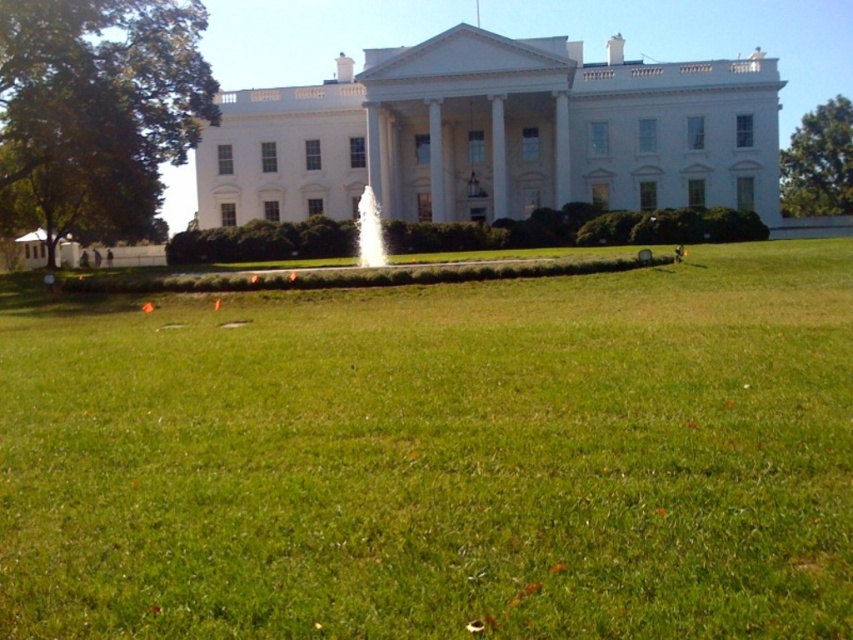
Based on the photo, you are standing at the entrance of the White House and want to walk towards the fountain located at the center of the lawn. The fountain is marked at coordinate point 0.716 on the x axis and 0.513 on the y axis. If you start walking straight ahead from the entrance, will you reach the fountain before reaching the green grass at center?

The green grass at center is located at the same coordinates as the fountain, so walking straight ahead from the entrance will lead you to both the fountain and the green grass at center simultaneously.

You are planning a small outdoor event on the lawn of the White House. You need to place a 3m wide tent. Considering the green grass at center and the white stone fountain at center, which area can accommodate the tent without overlapping the fountain?

The green grass at center has a greater width than the white stone fountain at center, so the tent can be placed on the green grass at center as it is wider and can accommodate the 3m wide tent without overlapping the fountain.